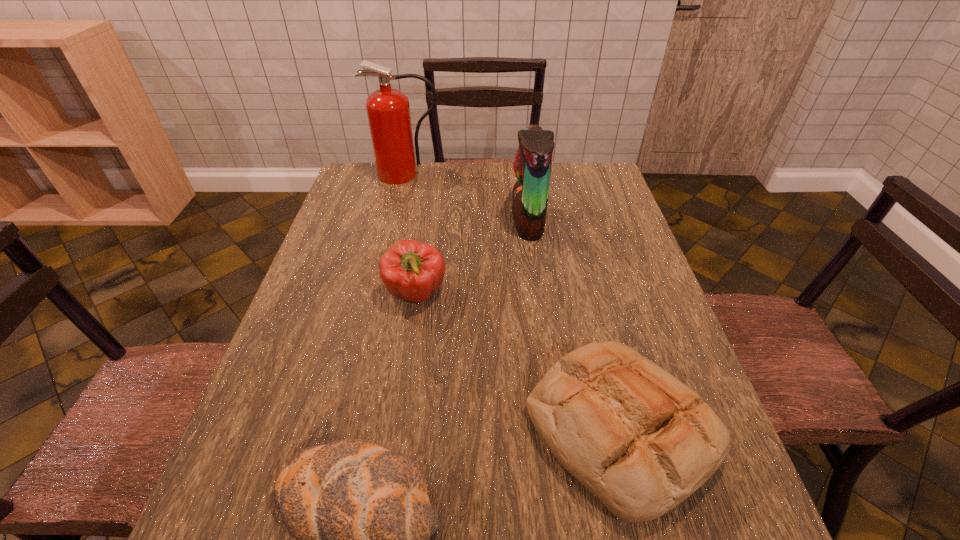
Select which object appears as the third closest to the parrot. Please provide its 2D coordinates. Your answer should be formatted as a tuple, i.e. [(x, y)], where the tuple contains the x and y coordinates of a point satisfying the conditions above.

[(640, 440)]

The image size is (960, 540). In order to click on object that is the closest to the right bread in this screenshot , I will do `click(361, 515)`.

At what (x,y) coordinates should I click in order to perform the action: click on free location that satisfies the following two spatial constraints: 1. at the face of the taller bread; 2. on the right side of the second farthest object. Please return your answer as a coordinate pair (x, y). The image size is (960, 540). Looking at the image, I should click on (556, 430).

You are a GUI agent. You are given a task and a screenshot of the screen. Output one action in this format:
    pyautogui.click(x=<x>, y=<y>)
    Task: Click on the vacant space that satisfies the following two spatial constraints: 1. with the handle and nozzle on the taller bread; 2. on the right side of the farthest object
    This screenshot has width=960, height=540.
    Given the screenshot: What is the action you would take?
    pyautogui.click(x=346, y=430)

I want to click on free spot that satisfies the following two spatial constraints: 1. on the front side of the taller bread; 2. on the left side of the third nearest object, so click(x=396, y=430).

You are a GUI agent. You are given a task and a screenshot of the screen. Output one action in this format:
    pyautogui.click(x=<x>, y=<y>)
    Task: Click on the vacant space that satisfies the following two spatial constraints: 1. at the face of the right bread; 2. on the right side of the fourth shortest object
    The width and height of the screenshot is (960, 540).
    Given the screenshot: What is the action you would take?
    pyautogui.click(x=556, y=430)